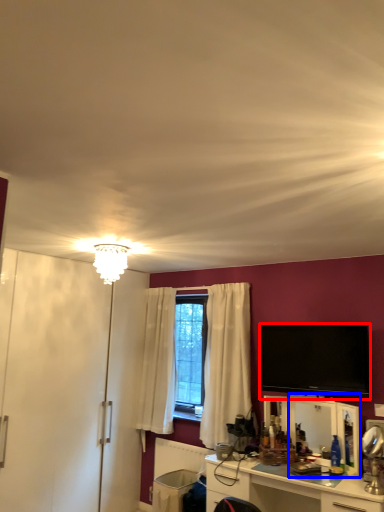
Question: Among these objects, which one is nearest to the camera, television (highlighted by a red box) or mirror (highlighted by a blue box)?

Choices:
 (A) television
 (B) mirror

Answer: (B)